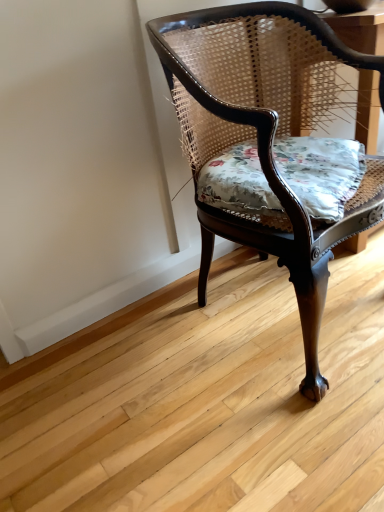
Identify the location of vacant region in front of mahogany cane chair at center. (265, 431).